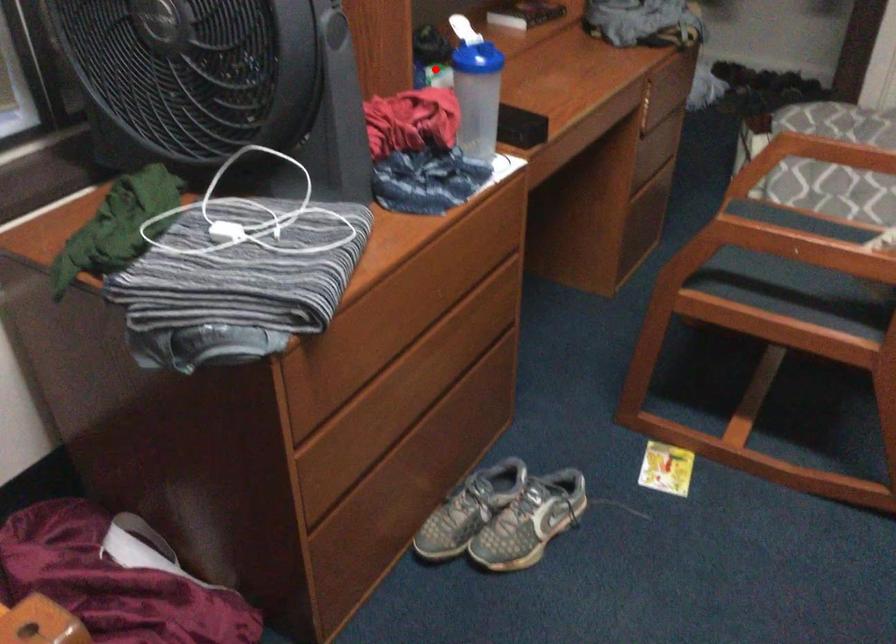
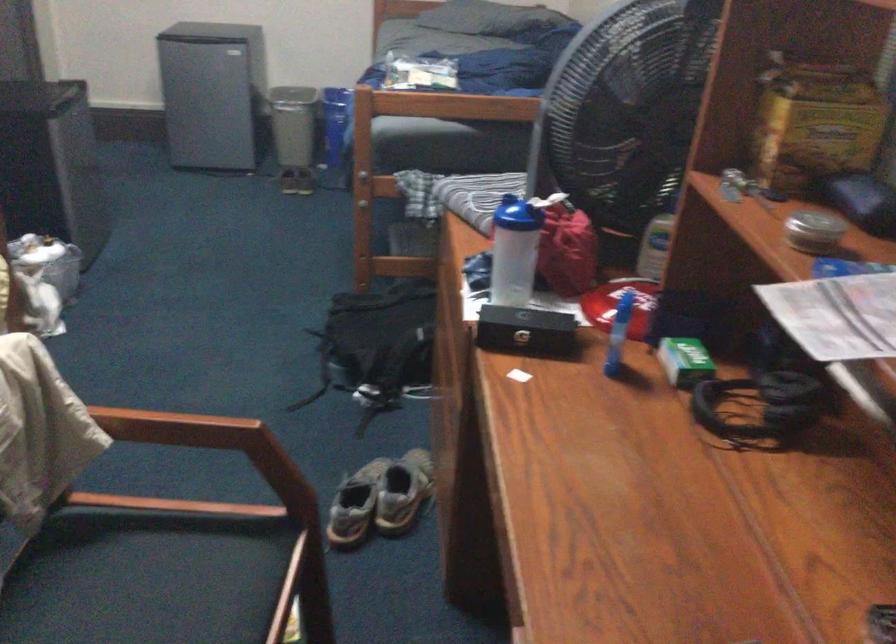
Find the pixel in the second image that matches the highlighted location in the first image.

(685, 361)